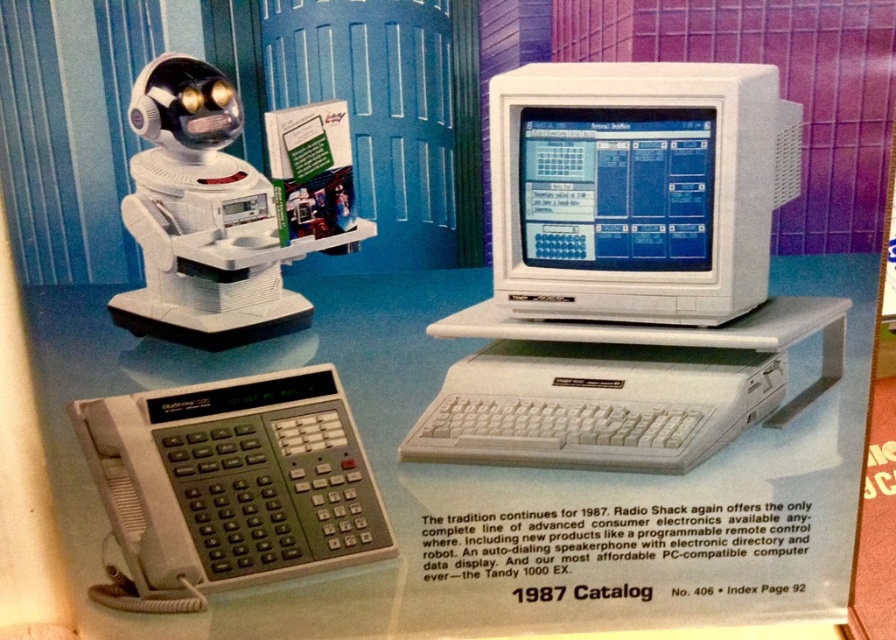
Between white plastic monitor at center and blue glossy monitor at center, which one has less height?

With less height is blue glossy monitor at center.

Can you confirm if white plastic monitor at center is positioned above blue glossy monitor at center?

Incorrect, white plastic monitor at center is not positioned above blue glossy monitor at center.

Where is `white plastic monitor at center`? white plastic monitor at center is located at coordinates (636, 188).

Can you confirm if white plastic desktop computer at center is bigger than white plastic monitor at center?

Yes.

Can you confirm if white plastic desktop computer at center is positioned to the right of white plastic monitor at center?

Indeed, white plastic desktop computer at center is positioned on the right side of white plastic monitor at center.

Locate an element on the screen. white plastic desktop computer at center is located at coordinates (629, 272).

Does white plastic desktop computer at center have a smaller size compared to blue glossy monitor at center?

No, white plastic desktop computer at center is not smaller than blue glossy monitor at center.

This screenshot has height=640, width=896. What are the coordinates of `white plastic desktop computer at center` in the screenshot? It's located at (629, 272).